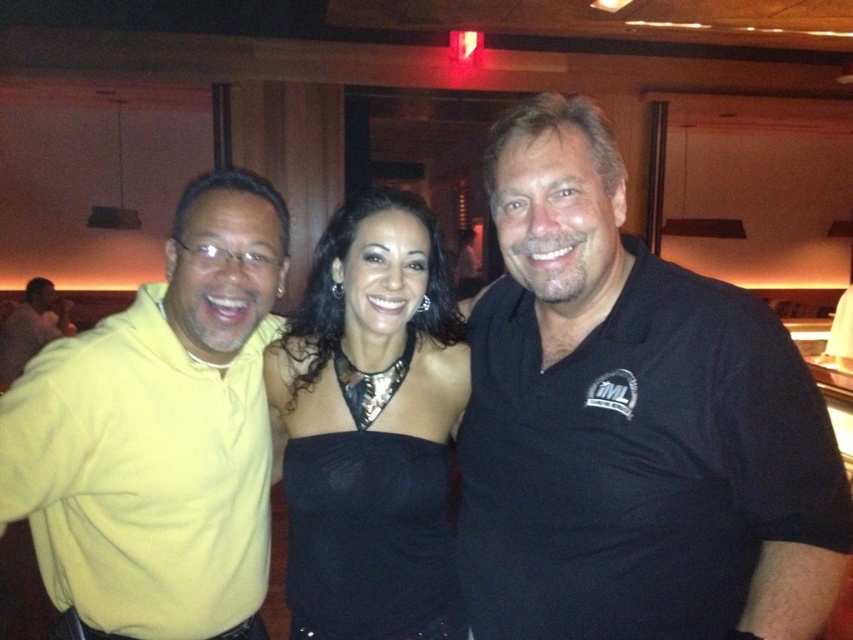
You are standing in the venue and want to take a photo of the black satin dress at center. Where should you position yourself to capture it in the frame?

The black satin dress at center is located at coordinates approximately 0.669 on the x axis and 0.436 on the y axis, so you should position yourself facing towards that point to capture it in the frame.

You are a photographer at the event and need to adjust the lighting to ensure both the yellow matte hoodie at left and the yellow matte shirt at left are well lit. Given their distance apart, can you use a single spotlight to illuminate both effectively?

The yellow matte hoodie at left and yellow matte shirt at left are 3.81 meters apart. A single spotlight may not cover both effectively due to the distance, so using two separate spotlights would be better to ensure proper illumination.

Based on the photo, you are a photographer at an event and need to adjust the camera focus. The two subjects are the black cotton shirt at right and the yellow matte hoodie at left. Since the camera can only focus on one subject at a time, which subject should you choose to ensure the other is slightly out of focus if they are 21.53 inches apart?

The camera can only focus on one subject at a time. To have the other subject slightly out of focus, you should focus on either the black cotton shirt at right or the yellow matte hoodie at left. The distance between them is 21.53 inches, so focusing on one will naturally blur the other depending on the lens and aperture settings.